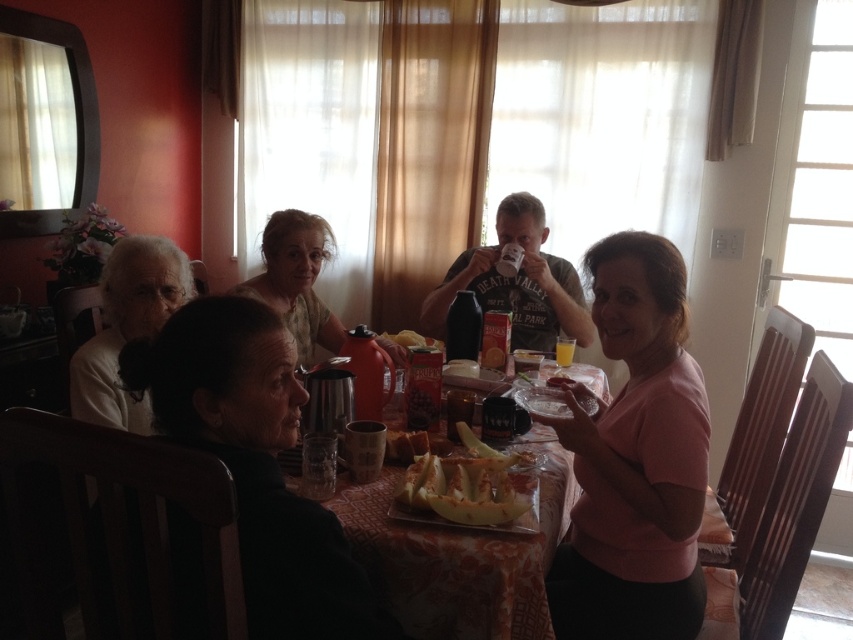
Looking at this image, you are a guest at this dinner and want to place your napkin on the table. Where should you put it so that it doesn not interfere with the orange printed tablecloth at center and the sliced yellow melon at center?

You should place your napkin on the table away from the orange printed tablecloth at center and the sliced yellow melon at center, perhaps on an empty space near the edge of the table.

Consider the image. You are a photographer standing at the center of the room. You want to take a photo of the dark brown hair at lower left. Which direction should you move to get a better angle?

The dark brown hair at lower left is located at point 0.725 in the x coordinate and 0.301 in the y coordinate. Since you are at the center of the room, you should move towards the lower left direction to get a better angle.